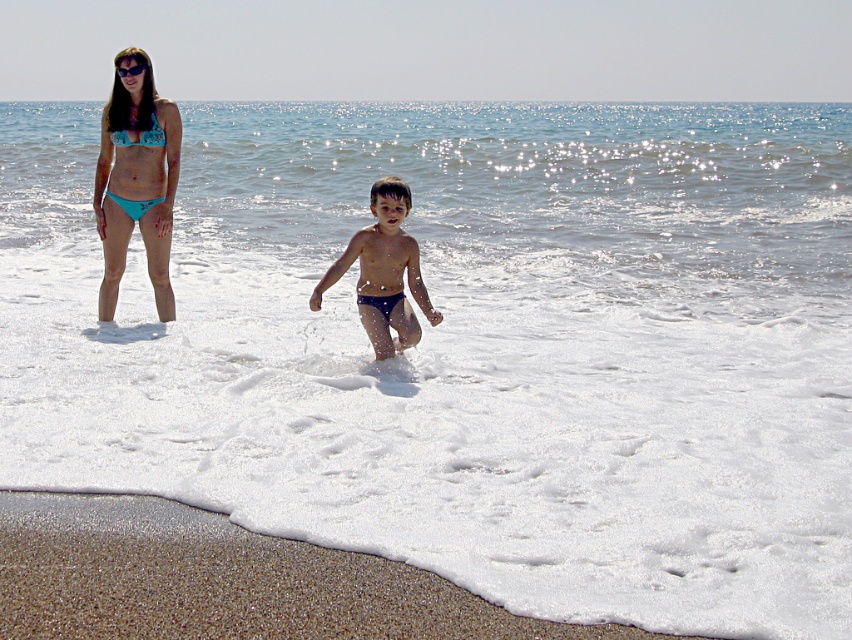
Is teal bikini at upper left taller than black plastic goggles at upper center?

Yes, teal bikini at upper left is taller than black plastic goggles at upper center.

Can you confirm if teal bikini at upper left is positioned to the left of black plastic goggles at upper center?

Yes, teal bikini at upper left is to the left of black plastic goggles at upper center.

Is point (119, 124) more distant than point (124, 72)?

Yes, it is behind point (124, 72).

Find the location of a particular element. Image resolution: width=852 pixels, height=640 pixels. teal bikini at upper left is located at coordinates (136, 180).

Is brown sandy beach at lower left positioned in front of blue fabric bikini at upper left?

That is True.

Can you confirm if brown sandy beach at lower left is positioned to the left of blue fabric bikini at upper left?

No, brown sandy beach at lower left is not to the left of blue fabric bikini at upper left.

Is point (68, 593) behind point (156, 198)?

No, it is not.

This screenshot has height=640, width=852. Identify the location of brown sandy beach at lower left. (220, 580).

From the picture: Is brown sandy beach at lower left to the left of teal bikini at upper left from the viewer's perspective?

No, brown sandy beach at lower left is not to the left of teal bikini at upper left.

Is point (438, 616) farther from viewer compared to point (162, 157)?

That is False.

Describe the element at coordinates (220, 580) in the screenshot. This screenshot has height=640, width=852. I see `brown sandy beach at lower left` at that location.

The image size is (852, 640). I want to click on brown sandy beach at lower left, so click(x=220, y=580).